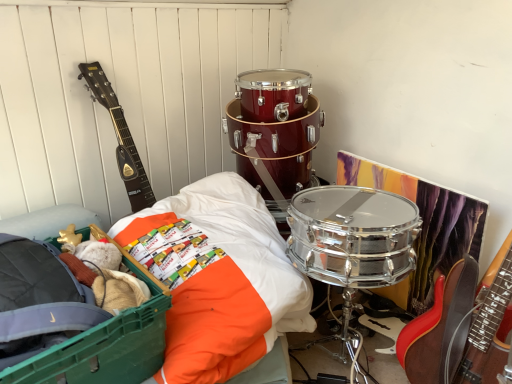
Question: Is dark wood acoustic guitar at left inside the boundaries of green plastic storage box at lower left, or outside?

Choices:
 (A) outside
 (B) inside

Answer: (A)

Question: In terms of height, does dark wood acoustic guitar at left look taller or shorter compared to green plastic storage box at lower left?

Choices:
 (A) short
 (B) tall

Answer: (B)

Question: Based on their relative distances, which object is farther from the orange fabric bedsheet at center-left?

Choices:
 (A) dark wood acoustic guitar at left
 (B) green plastic storage box at lower left

Answer: (A)

Question: Estimate the real-world distances between objects in this image. Which object is closer to the orange fabric bedsheet at center-left?

Choices:
 (A) dark wood acoustic guitar at left
 (B) green plastic storage box at lower left

Answer: (B)